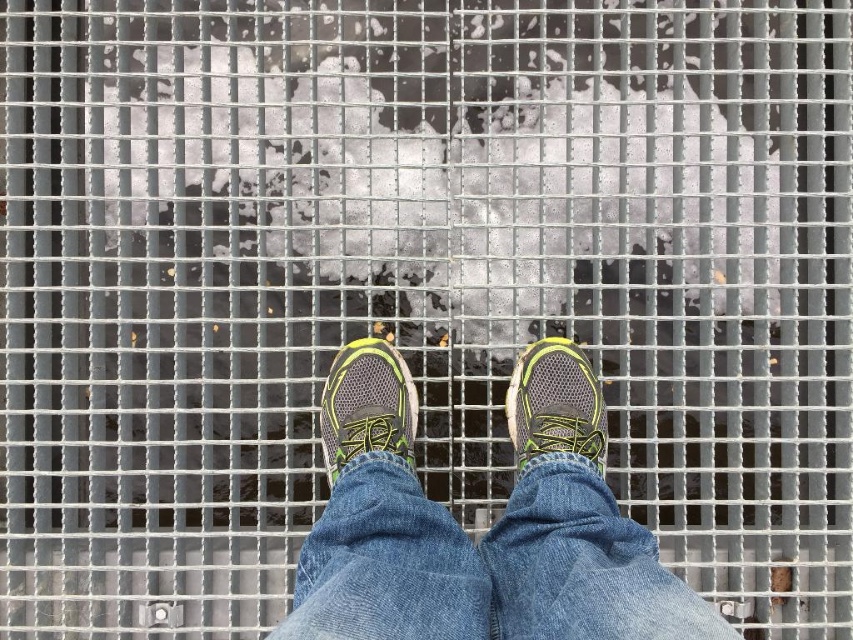
Does denim at center appear under gray mesh shoe at center?

Indeed, denim at center is positioned under gray mesh shoe at center.

Is denim at center shorter than gray mesh shoe at center?

No.

Where is `denim at center`? denim at center is located at coordinates coord(486,564).

What are the coordinates of `matte gray running shoe at center` in the screenshot? It's located at (366, 404).

From the picture: Which is more to the right, matte gray running shoe at center or gray mesh shoe at center?

Positioned to the right is gray mesh shoe at center.

Find the location of a particular element. This screenshot has width=853, height=640. matte gray running shoe at center is located at coordinates (366, 404).

Measure the distance between denim at center and camera.

1.89 meters

Can you confirm if denim at center is positioned to the right of matte gray running shoe at center?

Yes, denim at center is to the right of matte gray running shoe at center.

Is point (548, 496) in front of point (323, 390)?

Yes, point (548, 496) is in front of point (323, 390).

Find the location of a particular element. The image size is (853, 640). denim at center is located at coordinates click(486, 564).